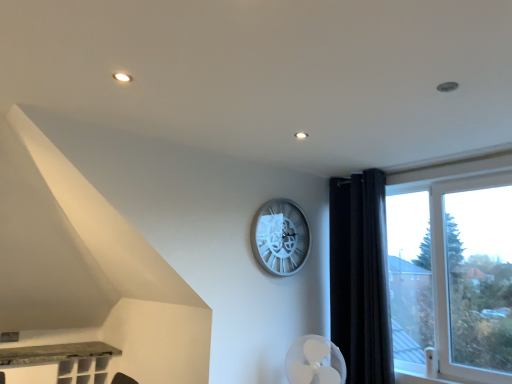
Question: Does silver metallic clock at center have a greater width compared to transparent glass window at right?

Choices:
 (A) no
 (B) yes

Answer: (A)

Question: From a real-world perspective, is silver metallic clock at center located beneath transparent glass window at right?

Choices:
 (A) yes
 (B) no

Answer: (B)

Question: Is transparent glass window at right at the back of silver metallic clock at center?

Choices:
 (A) yes
 (B) no

Answer: (B)

Question: Considering the relative sizes of silver metallic clock at center and transparent glass window at right in the image provided, is silver metallic clock at center thinner than transparent glass window at right?

Choices:
 (A) no
 (B) yes

Answer: (B)

Question: Would you say silver metallic clock at center contains transparent glass window at right?

Choices:
 (A) no
 (B) yes

Answer: (A)

Question: Are silver metallic clock at center and transparent glass window at right far apart?

Choices:
 (A) yes
 (B) no

Answer: (B)

Question: Does silver metallic clock at center have a greater width compared to black velvet curtain at right?

Choices:
 (A) no
 (B) yes

Answer: (A)

Question: Are silver metallic clock at center and black velvet curtain at right far apart?

Choices:
 (A) no
 (B) yes

Answer: (A)

Question: From the image's perspective, is silver metallic clock at center beneath black velvet curtain at right?

Choices:
 (A) no
 (B) yes

Answer: (A)

Question: Is silver metallic clock at center next to black velvet curtain at right?

Choices:
 (A) no
 (B) yes

Answer: (A)

Question: Could you tell me if silver metallic clock at center is turned towards black velvet curtain at right?

Choices:
 (A) no
 (B) yes

Answer: (A)

Question: Is black velvet curtain at right a part of silver metallic clock at center?

Choices:
 (A) yes
 (B) no

Answer: (B)

Question: Is black velvet curtain at right facing towards transparent glass window at right?

Choices:
 (A) no
 (B) yes

Answer: (A)